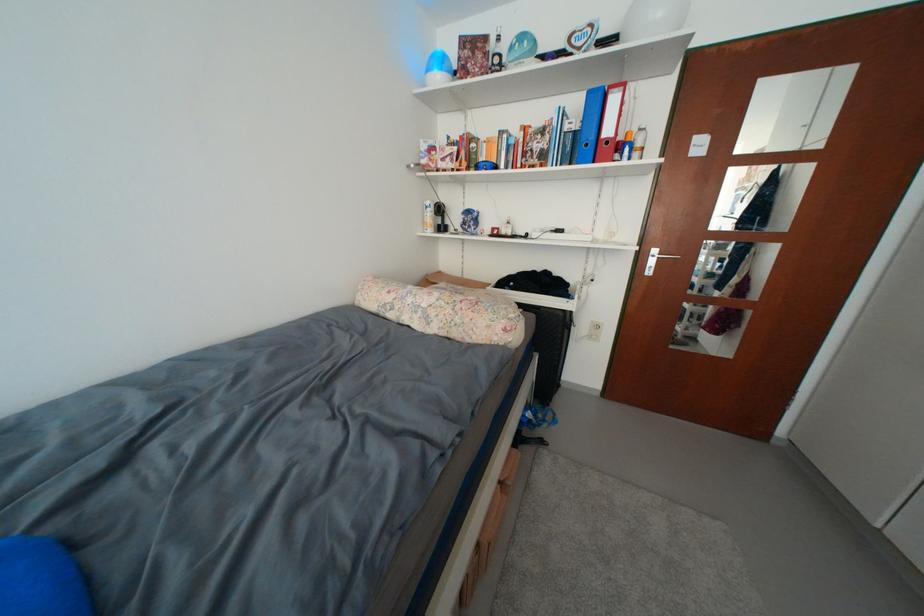
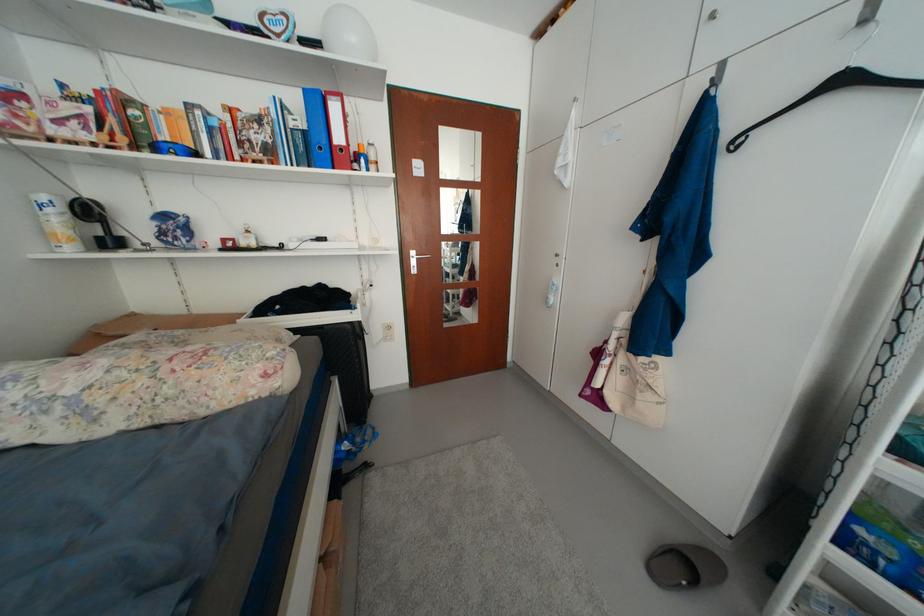
Question: Based on the continuous images, in which direction is the camera rotating? Reply with the corresponding letter.

Choices:
 (A) Left
 (B) Right
 (C) Up
 (D) Down

Answer: (B)